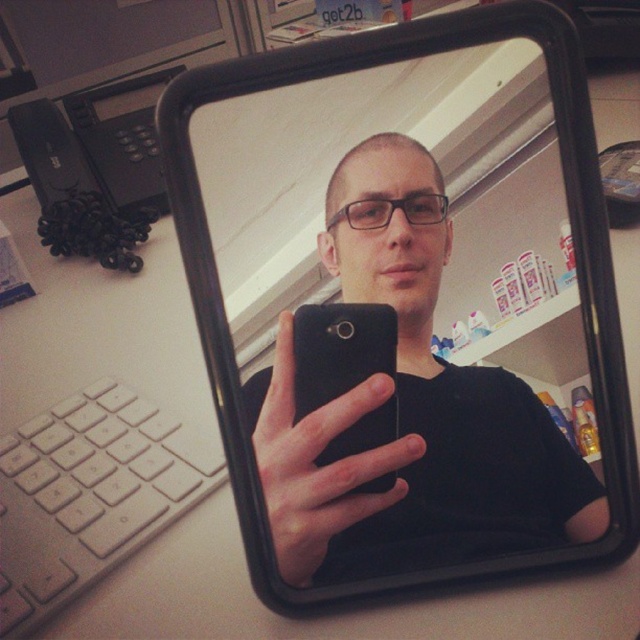
Question: Is black plastic view mirror at center positioned at the back of black matte smartphone at center?

Choices:
 (A) yes
 (B) no

Answer: (B)

Question: Which point is farther to the camera?

Choices:
 (A) (316, 400)
 (B) (396, 346)

Answer: (A)

Question: Does black plastic view mirror at center appear over black matte smartphone at center?

Choices:
 (A) no
 (B) yes

Answer: (B)

Question: Can you confirm if black plastic view mirror at center is positioned above black matte smartphone at center?

Choices:
 (A) no
 (B) yes

Answer: (B)